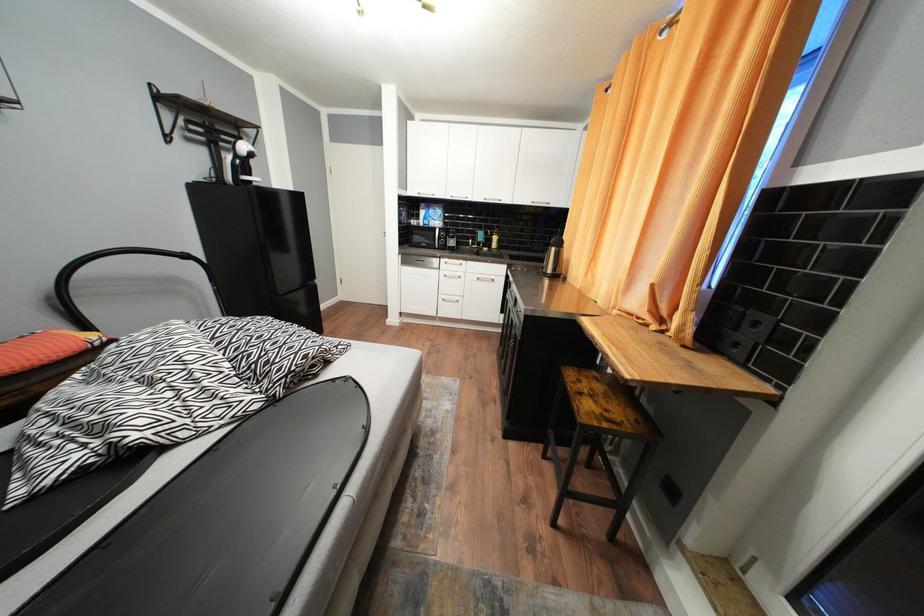
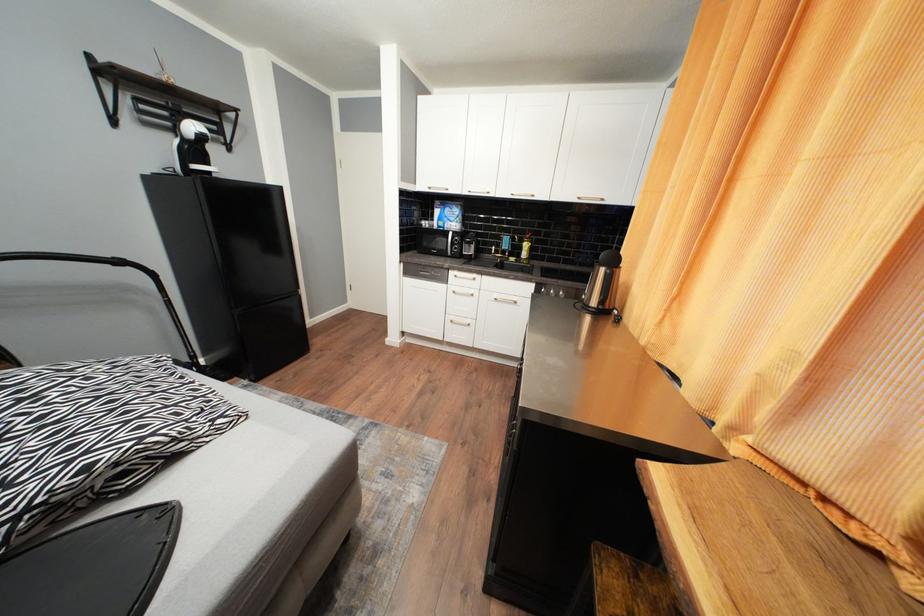
Question: The images are taken continuously from a first-person perspective. In which direction is your viewpoint rotating?

Choices:
 (A) Left
 (B) Right
 (C) Up
 (D) Down

Answer: (A)